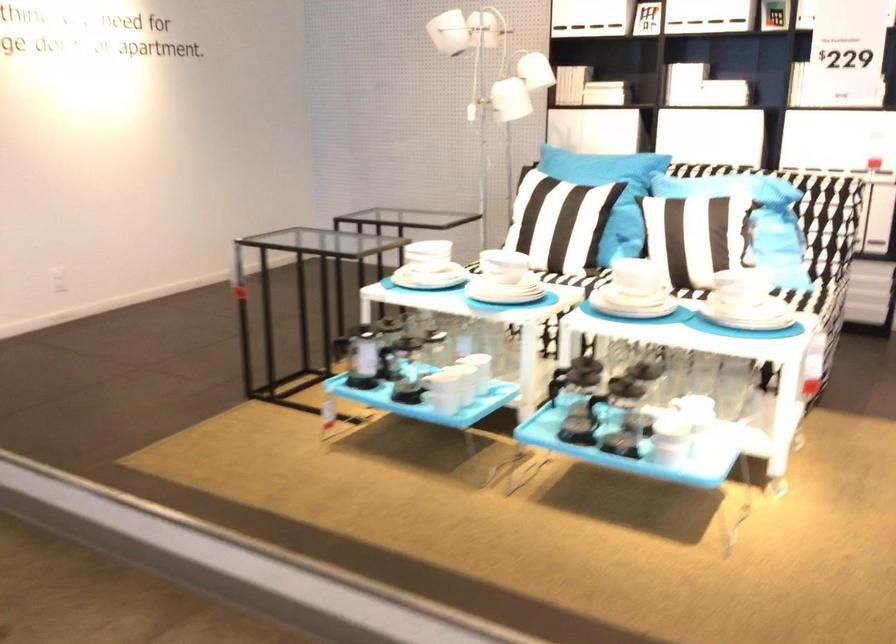
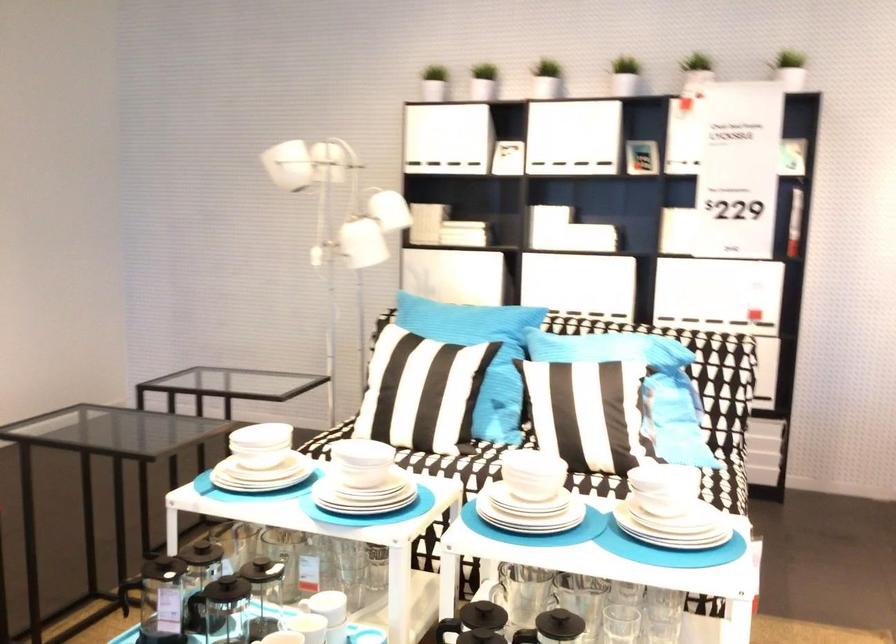
Where in the second image is the point corresponding to point 478,366 from the first image?

(329, 605)